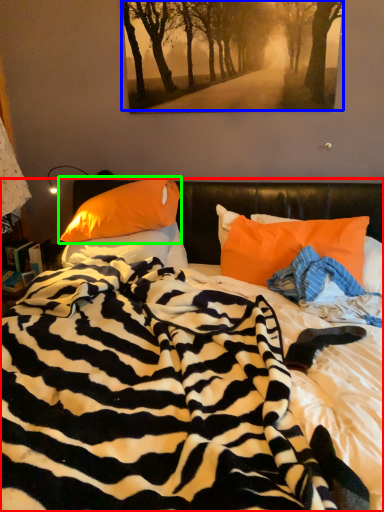
Question: Which is nearer to the bed (highlighted by a red box)? tree (highlighted by a blue box) or pillow (highlighted by a green box).

Choices:
 (A) tree
 (B) pillow

Answer: (B)